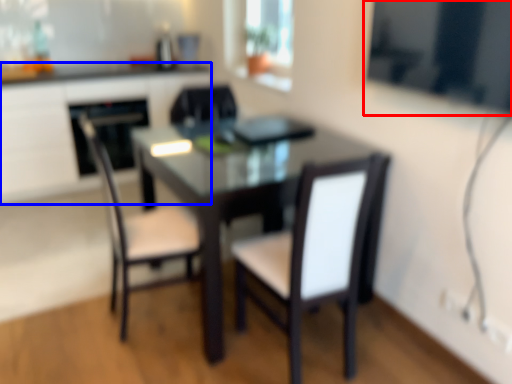
Question: Which object appears farthest to the camera in this image, window screen (highlighted by a red box) or computer desk (highlighted by a blue box)?

Choices:
 (A) window screen
 (B) computer desk

Answer: (B)